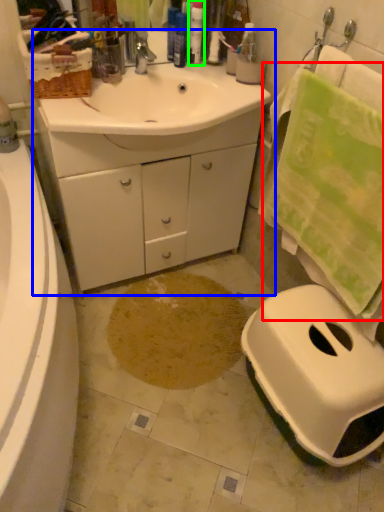
Question: Which is farther away from bath towel (highlighted by a red box)? bathroom cabinet (highlighted by a blue box) or toiletry (highlighted by a green box)?

Choices:
 (A) bathroom cabinet
 (B) toiletry

Answer: (B)